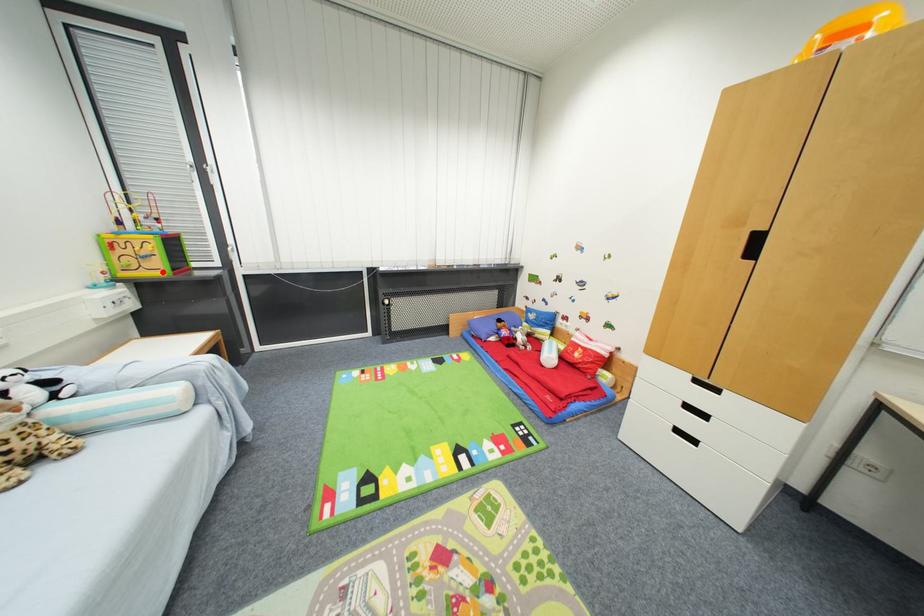
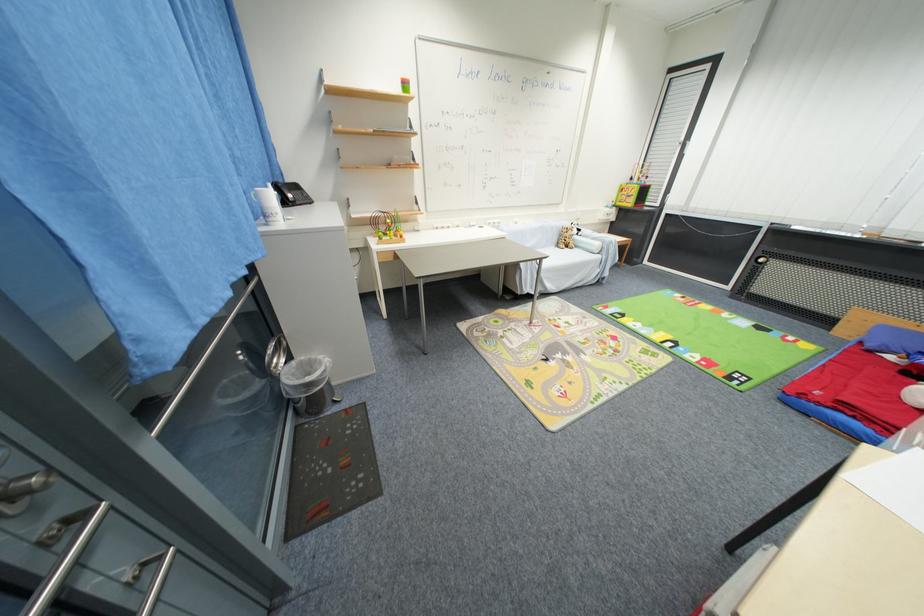
Question: I am providing you with two images of the same scene from different viewpoints. Given a red point in image1, look at the same physical point in image2. Is it:

Choices:
 (A) Closer to the viewpoint
 (B) Farther from the viewpoint

Answer: (A)